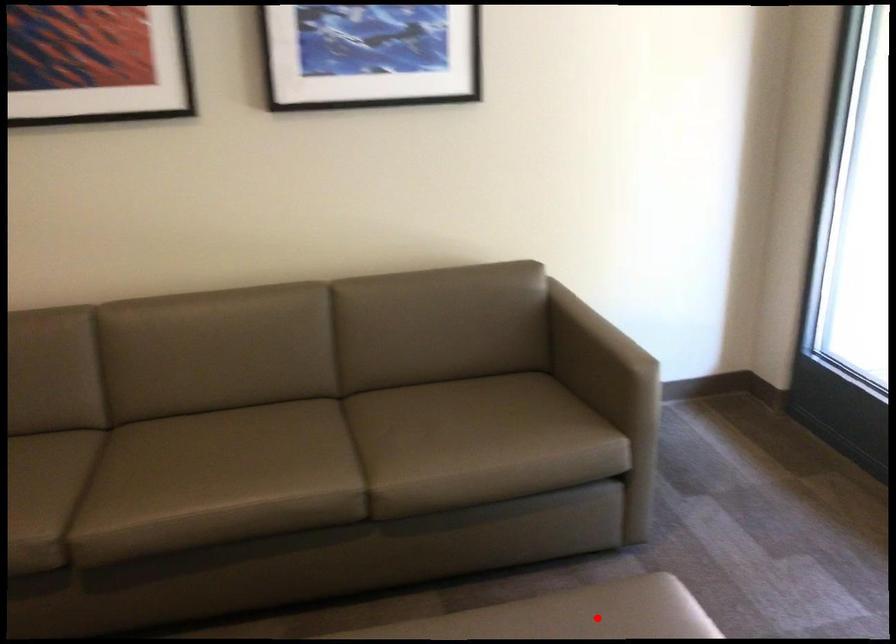
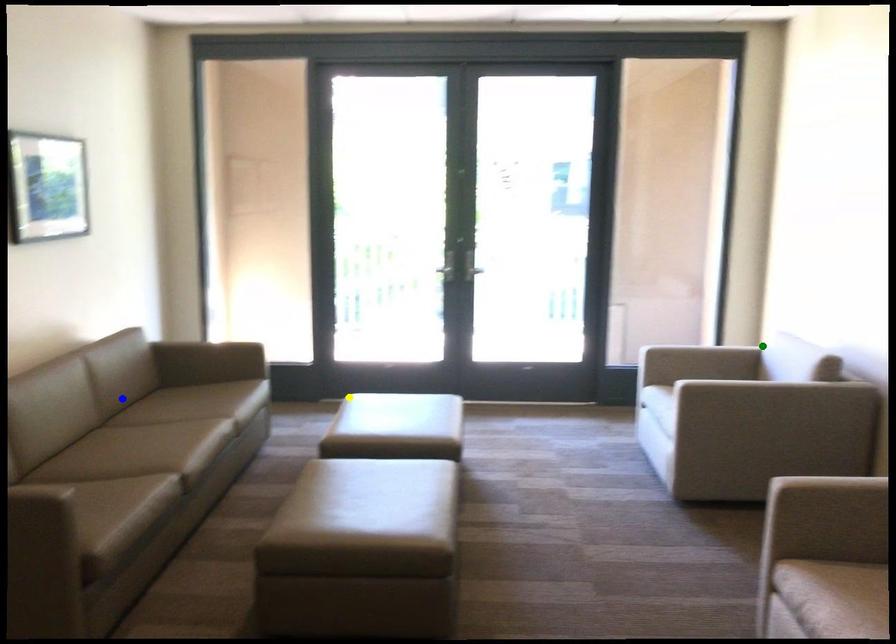
Question: I am providing you with two images of the same scene from different viewpoints. A red point is marked on the first image. You are given multiple points on the second image. In image 2, which mark is for the same physical point as the one in image 1?

Choices:
 (A) green point
 (B) yellow point
 (C) blue point

Answer: (B)